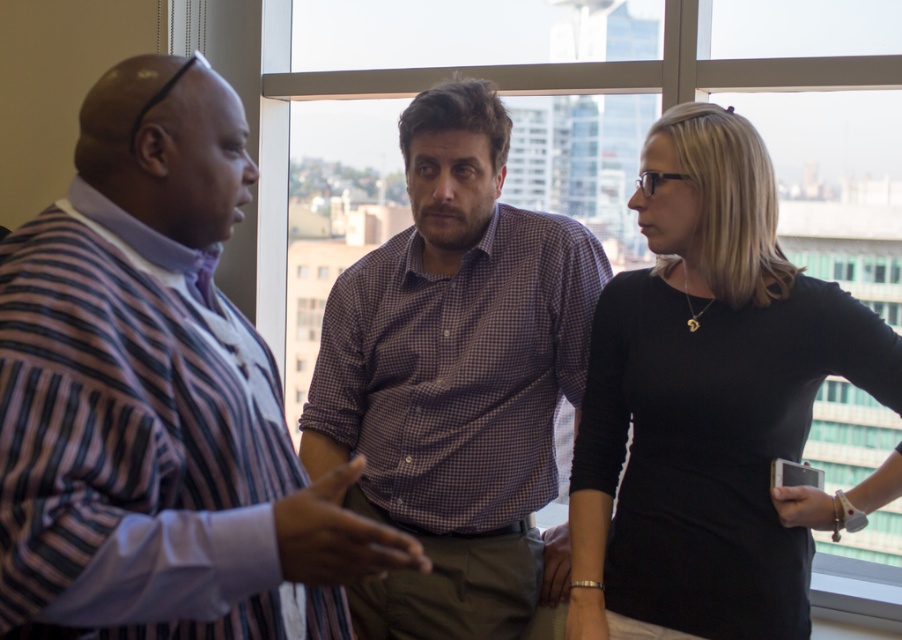
Question: Is striped fabric shirt at center below transparent glass window at center?

Choices:
 (A) yes
 (B) no

Answer: (A)

Question: Can you confirm if striped fabric shirt at center is thinner than purple checkered shirt at center?

Choices:
 (A) no
 (B) yes

Answer: (B)

Question: Based on their relative distances, which object is farther from the purple checkered shirt at center?

Choices:
 (A) striped fabric shirt at center
 (B) transparent glass window at center
 (C) black matte dress at center

Answer: (B)

Question: Which object appears farthest from the camera in this image?

Choices:
 (A) striped fabric shirt at center
 (B) transparent glass window at center
 (C) black matte dress at center
 (D) purple checkered shirt at center

Answer: (B)

Question: Among these points, which one is nearest to the camera?

Choices:
 (A) (638, 404)
 (B) (575, 387)
 (C) (242, 634)
 (D) (835, 598)

Answer: (C)

Question: Can you confirm if black matte dress at center is positioned above purple checkered shirt at center?

Choices:
 (A) yes
 (B) no

Answer: (B)